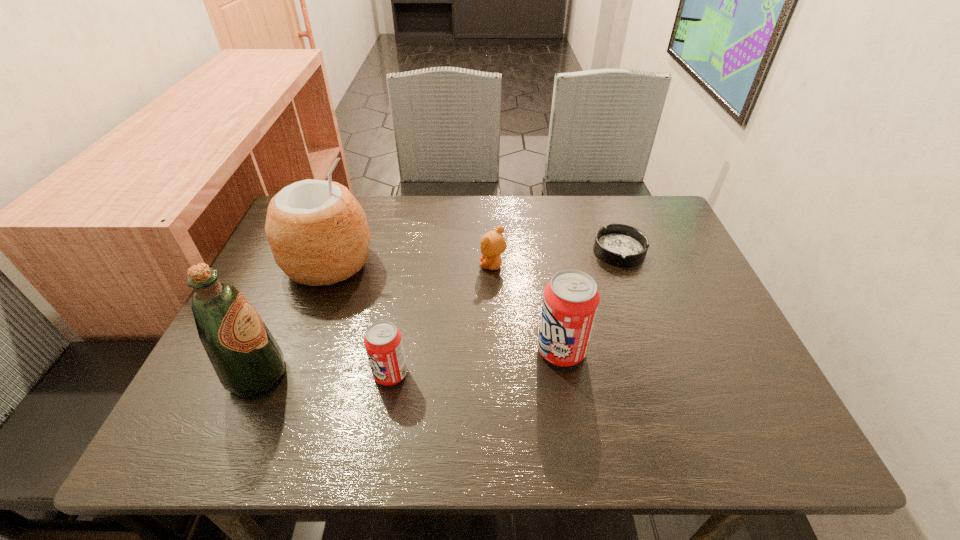
Identify the location of vacant spot to place a soda can on the right. The height and width of the screenshot is (540, 960). (717, 329).